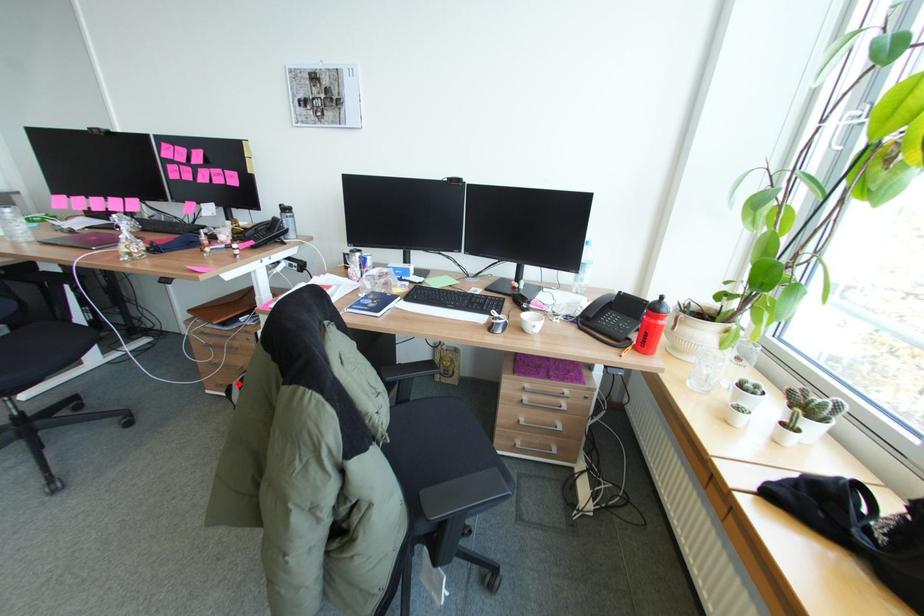
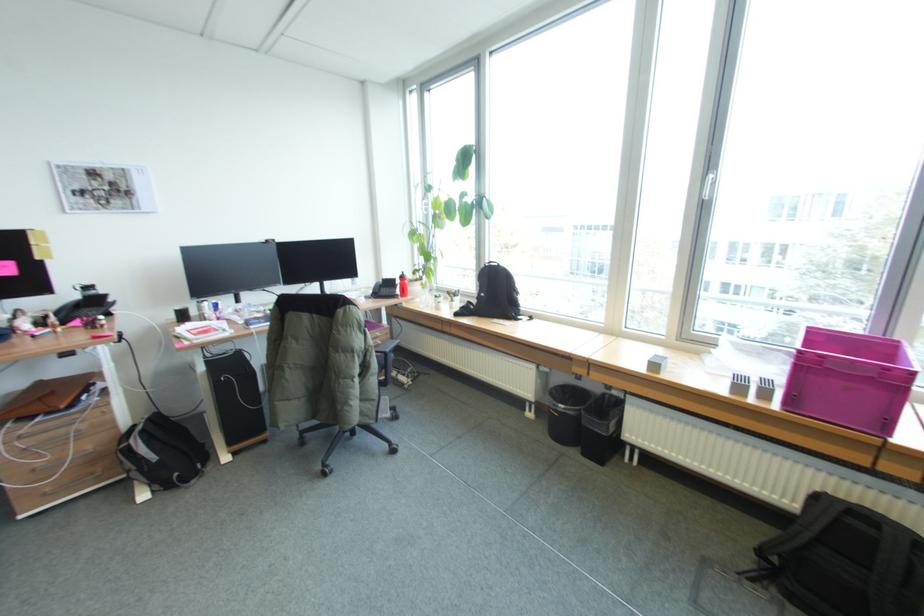
Question: A red point is marked in image1. In image2, is the corresponding 3D point closer to the camera or farther? Reply with the corresponding letter.

Choices:
 (A) The corresponding 3D point is closer.
 (B) The corresponding 3D point is farther.

Answer: (A)